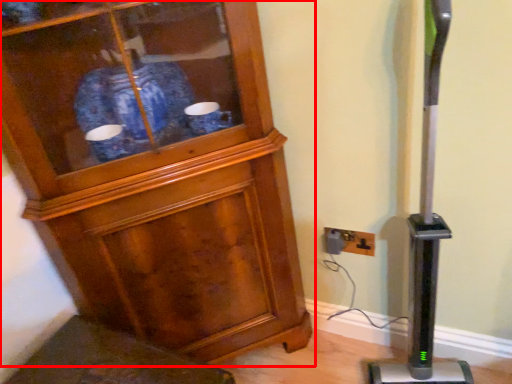
Question: In this image, where is cupboard (annotated by the red box) located relative to electric outlet?

Choices:
 (A) left
 (B) right

Answer: (A)